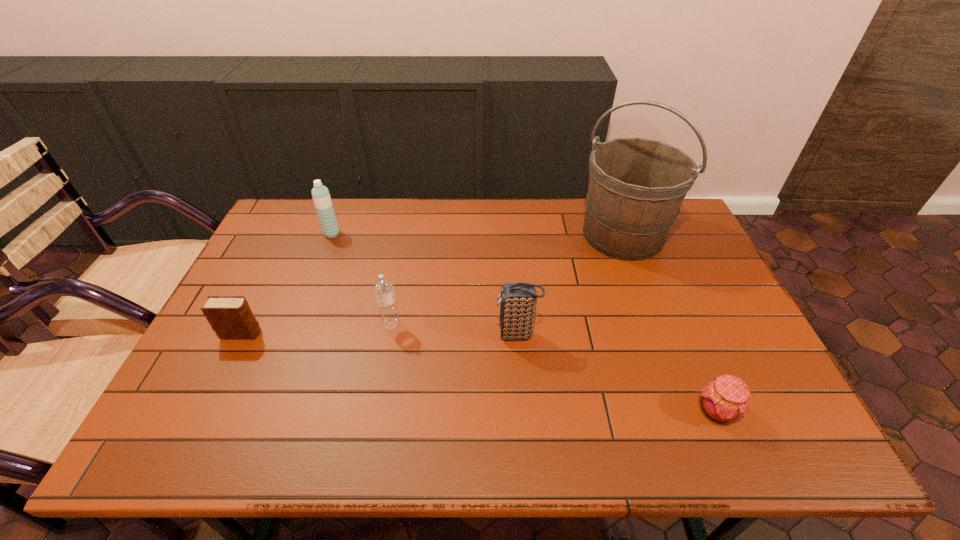
The width and height of the screenshot is (960, 540). What are the coordinates of `the tallest object` in the screenshot? It's located at (636, 187).

Find the location of `the farther water bottle`. the farther water bottle is located at coordinates (320, 194).

What are the coordinates of `the left water bottle` in the screenshot? It's located at (320, 194).

This screenshot has width=960, height=540. I want to click on clutch bag, so click(x=518, y=301).

Where is `the right water bottle`? the right water bottle is located at coordinates (383, 287).

Locate an element on the screen. The width and height of the screenshot is (960, 540). the nearer water bottle is located at coordinates (383, 287).

Locate an element on the screen. diary is located at coordinates (231, 317).

Locate an element on the screen. The width and height of the screenshot is (960, 540). the fifth tallest object is located at coordinates (231, 317).

Identify the location of the nearest object. [723, 400].

You are a GUI agent. You are given a task and a screenshot of the screen. Output one action in this format:
    pyautogui.click(x=<x>, y=<y>)
    Task: Click on the jam
    The height and width of the screenshot is (540, 960).
    Given the screenshot: What is the action you would take?
    pyautogui.click(x=723, y=400)